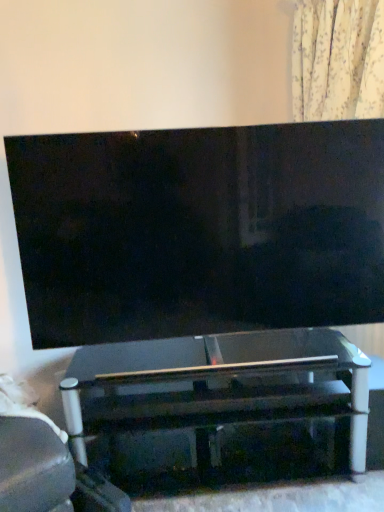
Question: Is transparent glass table at center at the left side of matte black tv at center?

Choices:
 (A) yes
 (B) no

Answer: (B)

Question: From the image's perspective, is transparent glass table at center above matte black tv at center?

Choices:
 (A) no
 (B) yes

Answer: (A)

Question: Is transparent glass table at center positioned beyond the bounds of matte black tv at center?

Choices:
 (A) yes
 (B) no

Answer: (A)

Question: Is transparent glass table at center bigger than matte black tv at center?

Choices:
 (A) yes
 (B) no

Answer: (A)

Question: Is transparent glass table at center closer to the viewer compared to matte black tv at center?

Choices:
 (A) no
 (B) yes

Answer: (A)

Question: Does transparent glass table at center touch matte black tv at center?

Choices:
 (A) no
 (B) yes

Answer: (A)

Question: Is matte black tv at center taller than transparent glass table at center?

Choices:
 (A) yes
 (B) no

Answer: (A)

Question: Is matte black tv at center shorter than transparent glass table at center?

Choices:
 (A) no
 (B) yes

Answer: (A)

Question: Considering the relative positions of matte black tv at center and transparent glass table at center in the image provided, is matte black tv at center to the left of transparent glass table at center from the viewer's perspective?

Choices:
 (A) no
 (B) yes

Answer: (B)

Question: Considering the relative sizes of matte black tv at center and transparent glass table at center in the image provided, is matte black tv at center wider than transparent glass table at center?

Choices:
 (A) yes
 (B) no

Answer: (B)

Question: From the image's perspective, is matte black tv at center under transparent glass table at center?

Choices:
 (A) yes
 (B) no

Answer: (B)

Question: Is transparent glass table at center at the back of matte black tv at center?

Choices:
 (A) no
 (B) yes

Answer: (A)

Question: From the image's perspective, is matte black tv at center located above or below transparent glass table at center?

Choices:
 (A) above
 (B) below

Answer: (A)